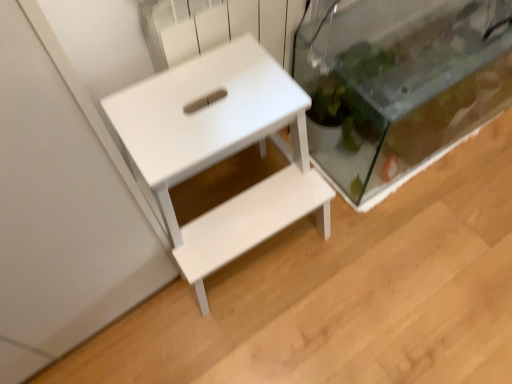
In order to click on vacant space in front of white matte table at center in this screenshot , I will do `click(246, 337)`.